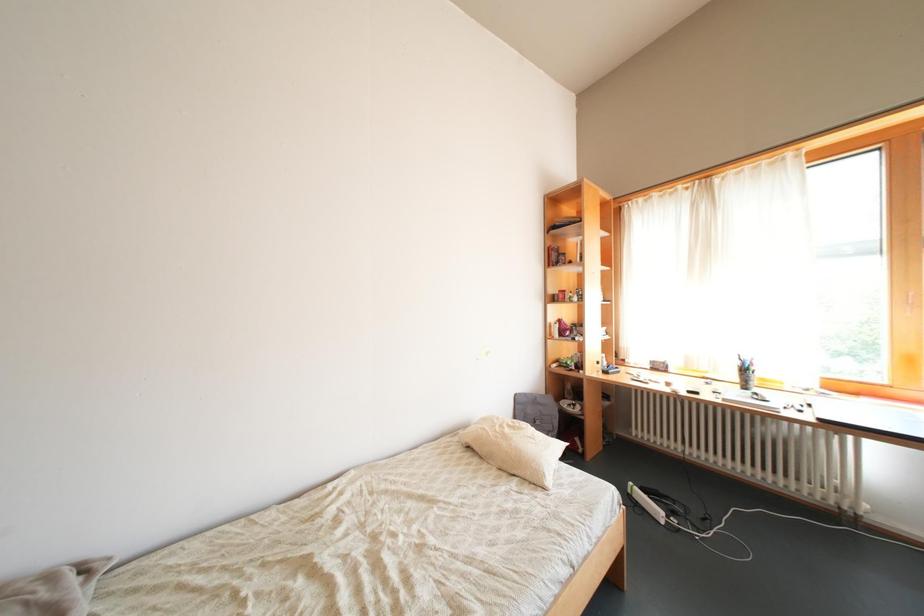
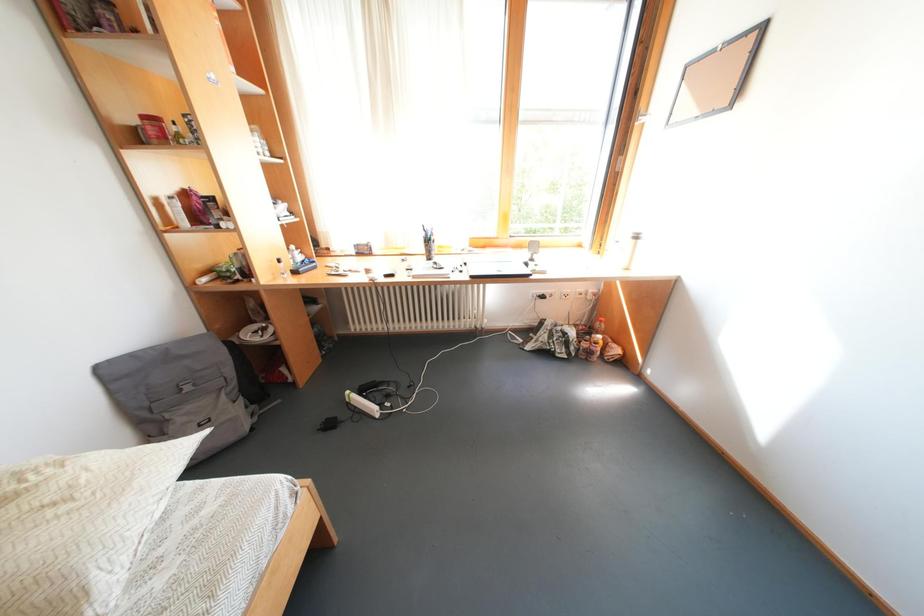
The images are taken continuously from a first-person perspective. In which direction is your viewpoint rotating?

The camera's rotation is toward right-down.